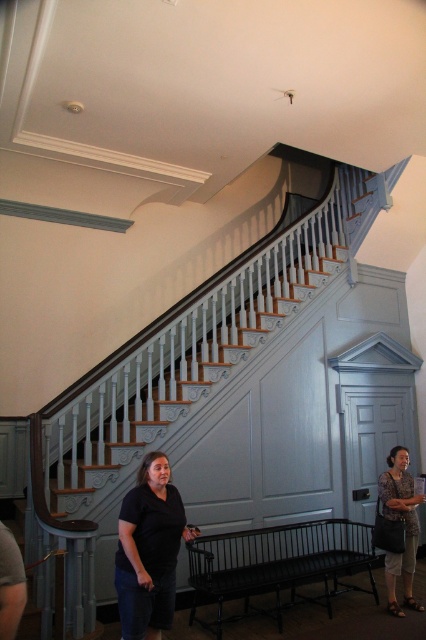
You are standing at the base of the grand staircase and want to sit down. Which object, the black metal bench at lower center or the printed fabric blouse at lower right, is closer to you?

The black metal bench at lower center is closer to you since it is positioned in front of the printed fabric blouse at lower right.

You are standing at the entrance of the building and want to sit down on the black metal bench at lower center. According to the scene description, where exactly is the bench positioned relative to the staircase?

The black metal bench at lower center is located at point (278,566), which places it near the base of the staircase in the foreground.